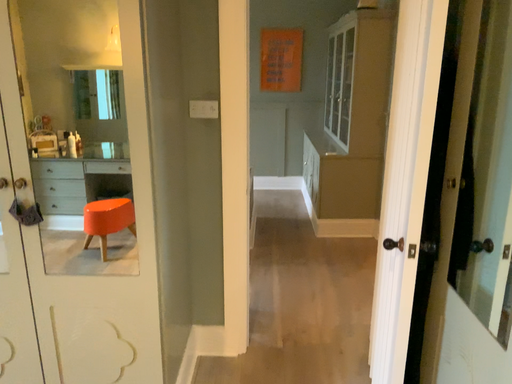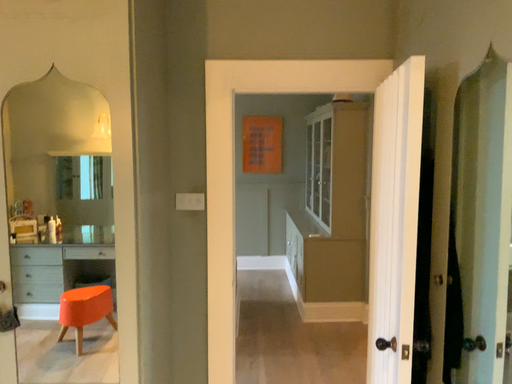
Question: Which way did the camera rotate in the video?

Choices:
 (A) rotated upward
 (B) rotated downward

Answer: (A)